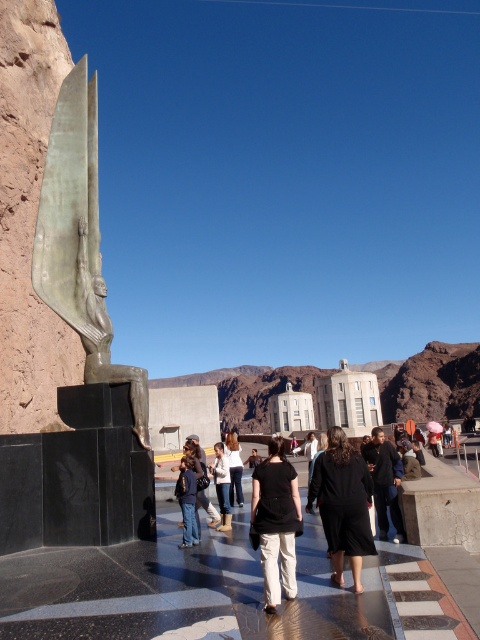
You are a photographer at the tourist attraction and want to capture both the black matte dress at center and the denim jacket at center in the same frame. Which object should you position closer to the left side of your camera viewfinder to ensure both are included?

To include both the black matte dress at center and the denim jacket at center in the frame, position the denim jacket at center closer to the left side of the camera viewfinder since the black matte dress at center is to the right of the denim jacket at center.

You are a photographer trying to capture a photo of the black matte dress at center and the denim jacket at center. Since you want to highlight the size difference between them, which object should you focus on to ensure the viewer notices the width difference?

The black matte dress at center has a larger width than the denim jacket at center, so focusing on the black matte dress at center will emphasize its greater width compared to the denim jacket at center.

You are a photographer standing at the camera position. You want to take a picture of the black matte dress at center. Is the dress within your camera frame?

The black matte dress at center is 24.26 meters from the camera. Since most cameras can focus on objects up to 20 meters away, the dress might be slightly out of focus or require a zoom lens to capture clearly. Adjust your camera settings or move closer for a better shot.